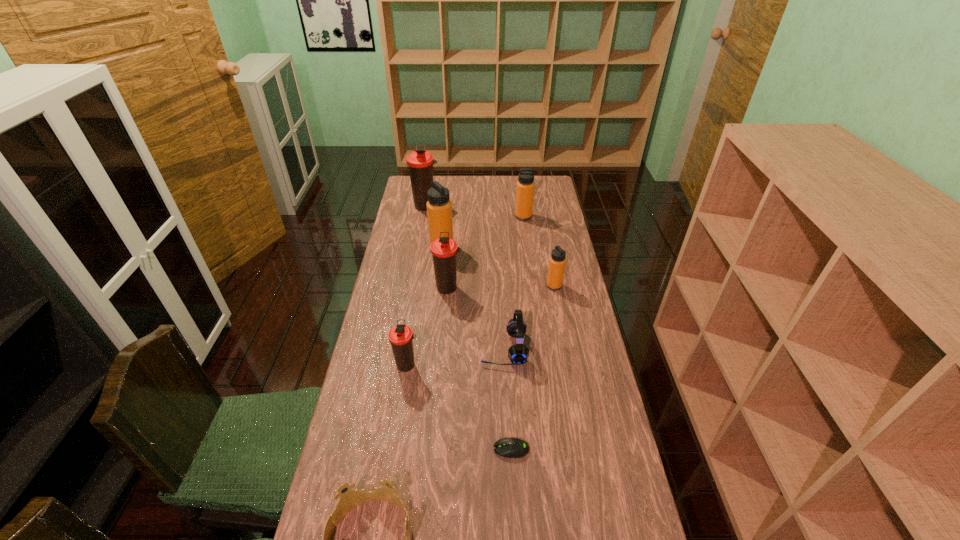
The image size is (960, 540). In order to click on vacant space situated on the ear cushions of the seventh tallest object in this screenshot , I will do `click(389, 349)`.

Where is `vacant space situated 0.260m on the ear cushions of the seventh tallest object`? The height and width of the screenshot is (540, 960). vacant space situated 0.260m on the ear cushions of the seventh tallest object is located at coordinates (401, 349).

Locate an element on the screen. The image size is (960, 540). vacant area located 0.310m on the ear cushions of the seventh tallest object is located at coordinates (386, 349).

Image resolution: width=960 pixels, height=540 pixels. In order to click on vacant point located 0.280m on the wheel side of the computer mouse in this screenshot , I will do `click(389, 449)`.

This screenshot has height=540, width=960. I want to click on vacant space located on the wheel side of the computer mouse, so click(400, 449).

At what (x,y) coordinates should I click in order to perform the action: click on vacant space situated 0.340m on the wheel side of the computer mouse. Please return your answer as a coordinate pair (x, y). Image resolution: width=960 pixels, height=540 pixels. Looking at the image, I should click on (367, 449).

Find the location of `object that is at the far edge`. object that is at the far edge is located at coordinates (420, 162).

Where is `object that is at the far left corner`? The image size is (960, 540). object that is at the far left corner is located at coordinates (420, 162).

I want to click on vacant space at the far edge of the desktop, so point(453,181).

You are a GUI agent. You are given a task and a screenshot of the screen. Output one action in this format:
    pyautogui.click(x=<x>, y=<y>)
    Task: Click on the free space at the left edge of the desktop
    This screenshot has width=960, height=540.
    Given the screenshot: What is the action you would take?
    pyautogui.click(x=369, y=536)